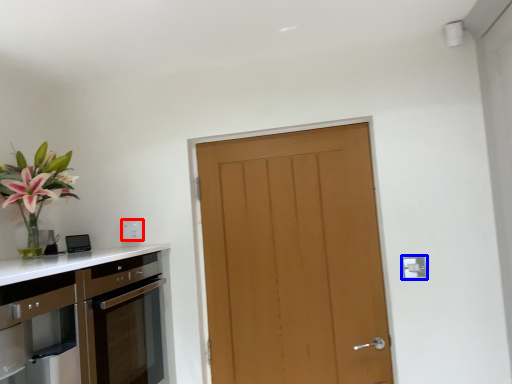
Question: Which point is further to the camera, electric outlet (highlighted by a red box) or electric outlet (highlighted by a blue box)?

Choices:
 (A) electric outlet
 (B) electric outlet

Answer: (A)